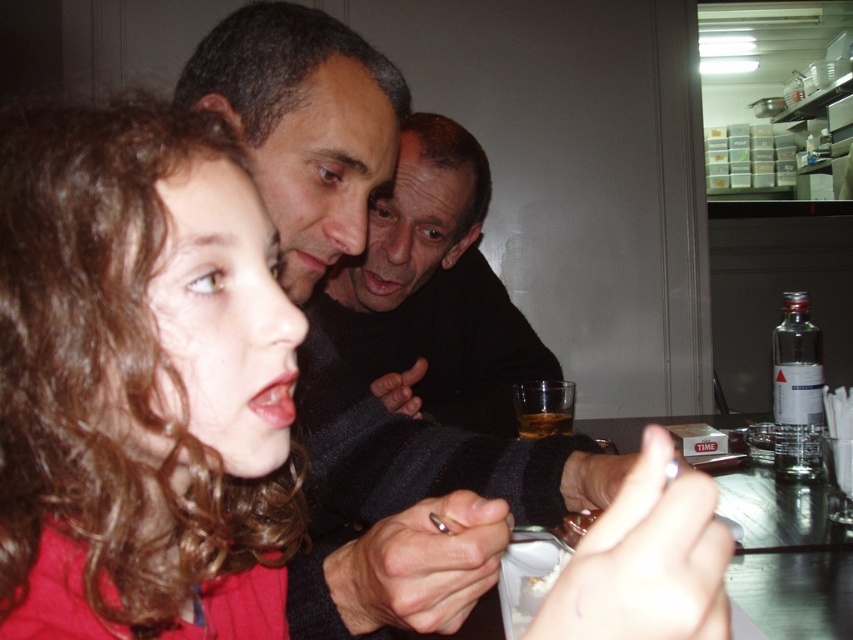
You are a photographer trying to capture a candid shot of the curly hair at center and dark matte face at center in the scene. The camera you are using has a maximum focus range of 70 centimeters. Can you fit both subjects within the camera focus range without moving the camera?

The distance between the curly hair at center and dark matte face at center is 69.86 centimeters, which is just under the camera maximum focus range of 70 centimeters. Therefore, both subjects can be captured within the focus range without moving the camera.

You are a photographer trying to capture a candid shot of the curly hair at center and the dark matte face at center. Which object should you focus on first to ensure both are in sharp focus?

You should focus on the curly hair at center first because it is closer to the viewer than the dark matte face at center. By focusing on the closer object, the farther object will also be in focus due to the depth of field.

From the picture: You are a photographer trying to capture a candid shot of the curly hair at center and the translucent glass bottle at center. If you want to ensure both subjects are in focus, which one should you adjust the camera focus on first, considering their sizes?

The curly hair at center is wider than the translucent glass bottle at center, so you should focus on the wider subject first to ensure both are in focus.